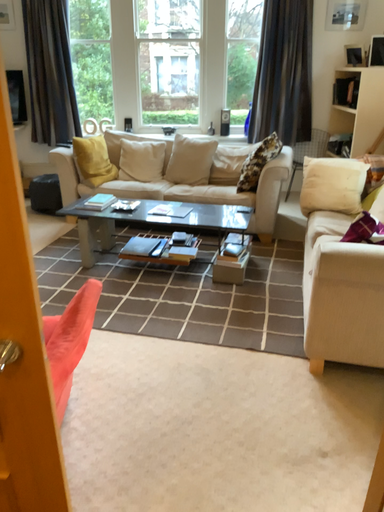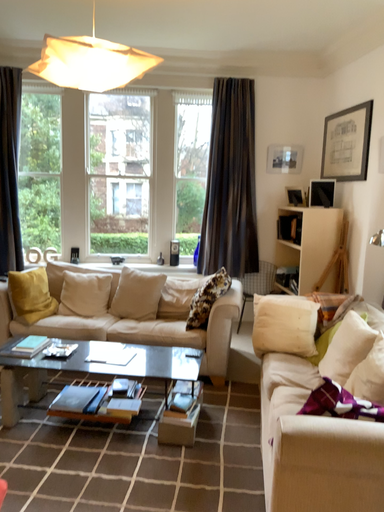
Question: How did the camera likely rotate when shooting the video?

Choices:
 (A) rotated downward
 (B) rotated upward

Answer: (B)